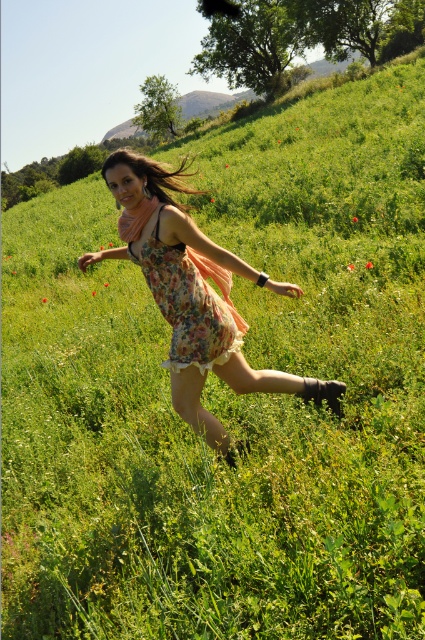
Question: Can you confirm if floral dress at center is wider than floral fabric dress at center?

Choices:
 (A) yes
 (B) no

Answer: (A)

Question: Which point is farther to the camera?

Choices:
 (A) (212, 317)
 (B) (215, 419)

Answer: (B)

Question: Does floral dress at center lie in front of floral fabric dress at center?

Choices:
 (A) no
 (B) yes

Answer: (B)

Question: Does floral dress at center appear on the left side of floral fabric dress at center?

Choices:
 (A) yes
 (B) no

Answer: (B)